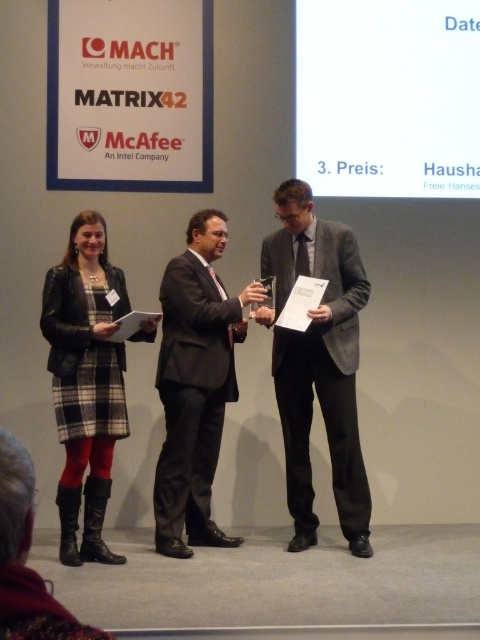
Who is higher up, gray suit at center or plaid fabric dress at left?

gray suit at center is higher up.

Locate an element on the screen. Image resolution: width=480 pixels, height=640 pixels. gray suit at center is located at coordinates (317, 362).

Does black suit at center appear on the left side of plaid fabric dress at left?

In fact, black suit at center is to the right of plaid fabric dress at left.

Can you confirm if black suit at center is positioned below plaid fabric dress at left?

Actually, black suit at center is above plaid fabric dress at left.

Between point (205, 314) and point (98, 241), which one is positioned behind?

The point (205, 314) is behind.

What are the coordinates of `black suit at center` in the screenshot? It's located at (195, 385).

Between point (296, 381) and point (210, 312), which one is positioned behind?

Positioned behind is point (296, 381).

Can you confirm if gray suit at center is smaller than black suit at center?

No, gray suit at center is not smaller than black suit at center.

Locate an element on the screen. The image size is (480, 640). gray suit at center is located at coordinates (317, 362).